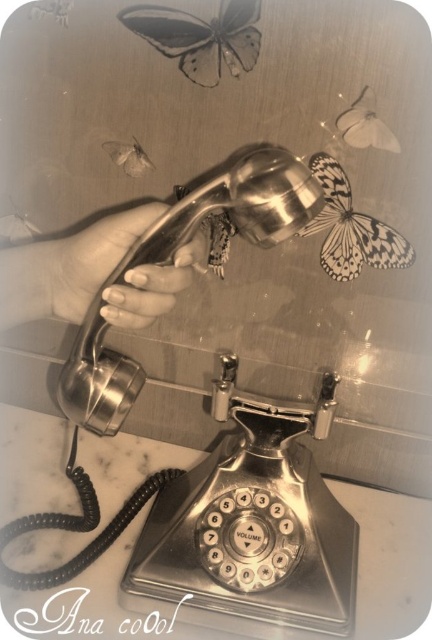
Question: Is silver metallic hand at center closer to the viewer compared to translucent paper butterfly at upper center?

Choices:
 (A) yes
 (B) no

Answer: (A)

Question: Can you confirm if white matte butterfly at upper left is positioned to the right of white paper butterfly at upper left?

Choices:
 (A) no
 (B) yes

Answer: (B)

Question: Which object is farther from the camera taking this photo?

Choices:
 (A) translucent paper butterfly at upper center
 (B) silver metallic hand at center
 (C) black and white patterned butterfly at upper right
 (D) white paper butterfly at upper left

Answer: (D)

Question: Which point appears farthest from the camera in this image?

Choices:
 (A) (110, 307)
 (B) (196, 76)
 (C) (334, 253)
 (D) (44, 16)

Answer: (C)

Question: Which is farther from the white paper butterfly at upper left?

Choices:
 (A) silver metallic hand at center
 (B) white matte butterfly at upper left

Answer: (A)

Question: Does black and white patterned butterfly at upper right appear under white matte butterfly at upper left?

Choices:
 (A) no
 (B) yes

Answer: (B)